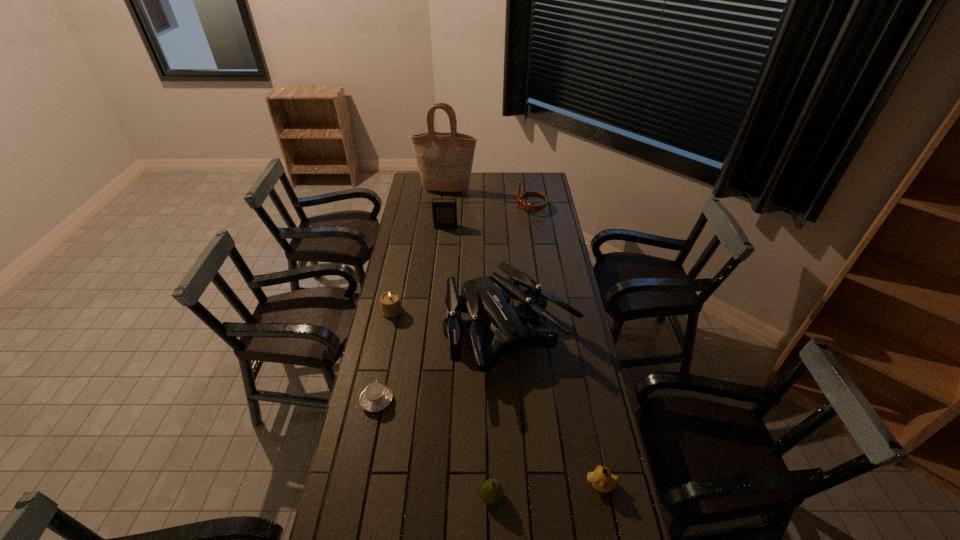
The image size is (960, 540). In order to click on vacant area situated 0.390m on the side with the handle of the shortest object in this screenshot , I will do `click(396, 308)`.

Find the location of a particular element. This screenshot has width=960, height=540. free space located 0.170m on the side with the handle of the shortest object is located at coordinates (387, 349).

This screenshot has width=960, height=540. Find the location of `vacant area located 0.310m on the side with the handle of the shortest object`. vacant area located 0.310m on the side with the handle of the shortest object is located at coordinates (393, 322).

Image resolution: width=960 pixels, height=540 pixels. Identify the location of object that is at the far edge. (x=444, y=160).

The width and height of the screenshot is (960, 540). Find the location of `shopping bag at the left edge`. shopping bag at the left edge is located at coordinates 444,160.

Identify the location of candle_holder located in the left edge section of the desktop. The height and width of the screenshot is (540, 960). (391, 305).

Image resolution: width=960 pixels, height=540 pixels. In order to click on teacup that is at the left edge in this screenshot , I will do `click(376, 396)`.

The width and height of the screenshot is (960, 540). What are the coordinates of `tiara that is at the right edge` in the screenshot? It's located at (529, 207).

In order to click on drone located in the right edge section of the desktop in this screenshot , I will do `click(488, 297)`.

I want to click on duckling that is at the right edge, so click(x=603, y=481).